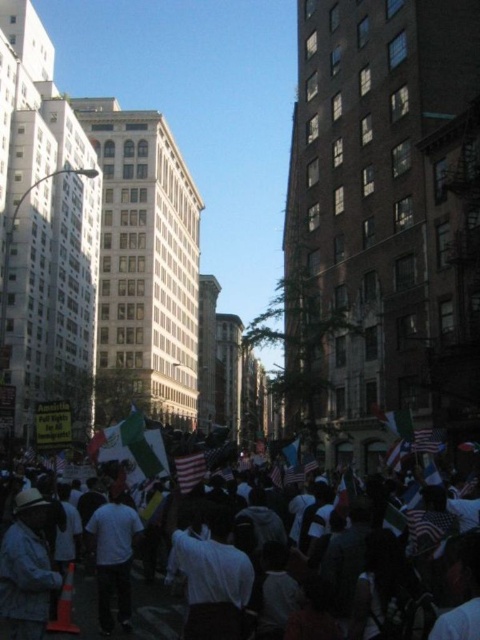
Question: Which object is the closest to the american flag at center?

Choices:
 (A) dark blue denim jacket at lower left
 (B) white matte shirt at center
 (C) white cotton crowd at center

Answer: (B)

Question: Which object appears farthest from the camera in this image?

Choices:
 (A) white cotton crowd at center
 (B) dark blue denim jacket at lower left
 (C) white matte shirt at center

Answer: (C)

Question: Is dark blue denim jacket at lower left above american flag at center?

Choices:
 (A) no
 (B) yes

Answer: (A)

Question: Can you confirm if white matte shirt at center is thinner than american flag at center?

Choices:
 (A) no
 (B) yes

Answer: (B)

Question: Which object is the farthest from the dark blue denim jacket at lower left?

Choices:
 (A) white matte shirt at center
 (B) american flag at center

Answer: (B)

Question: Is white matte shirt at center thinner than american flag at center?

Choices:
 (A) no
 (B) yes

Answer: (B)